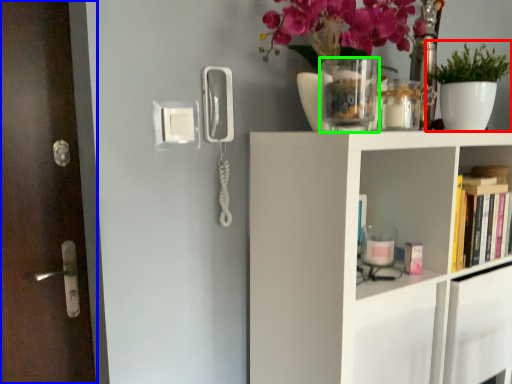
Question: Which is farther away from houseplant (highlighted by a red box)? door (highlighted by a blue box) or vase (highlighted by a green box)?

Choices:
 (A) door
 (B) vase

Answer: (A)